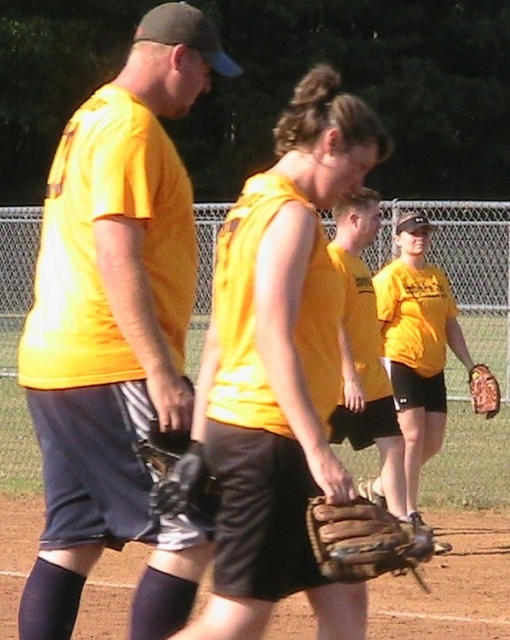
Question: Which point is farther to the camera?

Choices:
 (A) matte yellow shirt at left
 (B) matte yellow tank top at center
 (C) brown leather glove at center

Answer: (A)

Question: Considering the relative positions of matte yellow shirt at center and brown leather glove at center in the image provided, where is matte yellow shirt at center located with respect to brown leather glove at center?

Choices:
 (A) below
 (B) above

Answer: (B)

Question: Observing the image, what is the correct spatial positioning of matte yellow shirt at center in reference to brown leather glove at center?

Choices:
 (A) right
 (B) left

Answer: (A)

Question: Can you confirm if yellow matte baseball glove at center is thinner than matte yellow shirt at center?

Choices:
 (A) no
 (B) yes

Answer: (A)

Question: Which point is farther to the camera?

Choices:
 (A) pyautogui.click(x=430, y=452)
 (B) pyautogui.click(x=119, y=196)
 (C) pyautogui.click(x=484, y=392)
 (D) pyautogui.click(x=395, y=524)

Answer: (A)

Question: Among these objects, which one is nearest to the camera?

Choices:
 (A) yellow matte baseball glove at center
 (B) brown leather glove at center
 (C) matte yellow shirt at center
 (D) brown leather glove at lower right

Answer: (B)